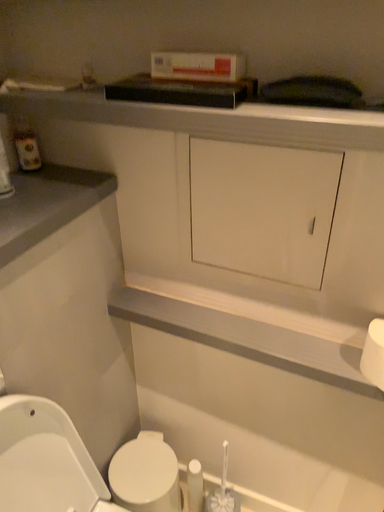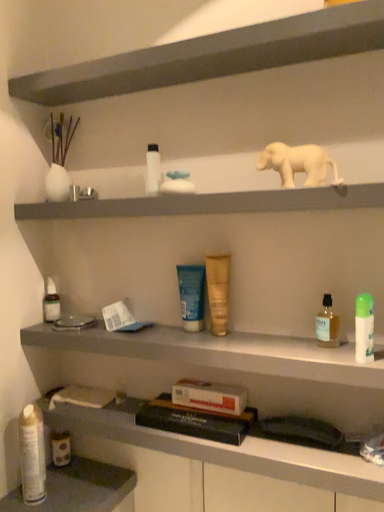
Question: How did the camera likely rotate when shooting the video?

Choices:
 (A) rotated upward
 (B) rotated downward

Answer: (A)